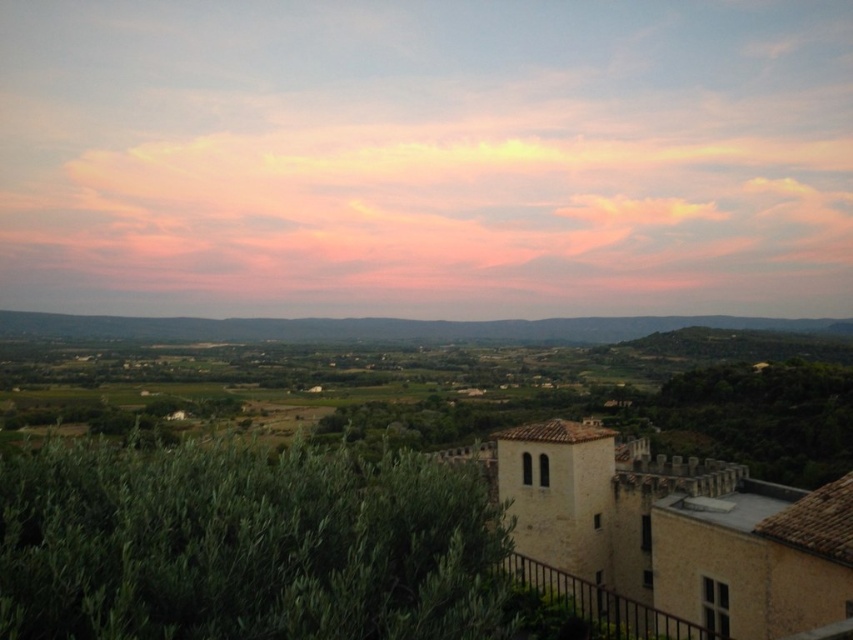
Is the position of green leafy bush at lower left more distant than that of gray/neutral horizon at center?

That is False.

Who is positioned more to the right, green leafy bush at lower left or gray/neutral horizon at center?

green leafy bush at lower left

Describe the element at coordinates (245, 545) in the screenshot. I see `green leafy bush at lower left` at that location.

Where is `green leafy bush at lower left`? This screenshot has height=640, width=853. green leafy bush at lower left is located at coordinates (245, 545).